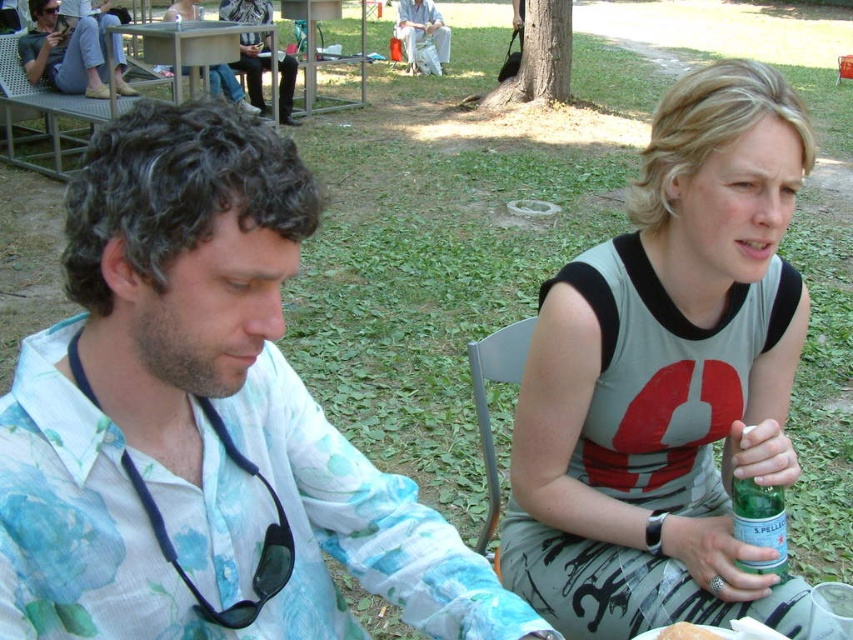
Question: Which object is closer to the camera taking this photo?

Choices:
 (A) black fabric stethoscope at left
 (B) gray fabric tank top at upper right

Answer: (A)

Question: Is gray fabric tank top at upper right thinner than green glass bottle at lower right?

Choices:
 (A) yes
 (B) no

Answer: (B)

Question: Estimate the real-world distances between objects in this image. Which object is closer to the white fluffy bread at lower center?

Choices:
 (A) matte black sunglasses at upper left
 (B) floral cotton shirt at left
 (C) green glass bottle at lower right

Answer: (C)

Question: Is green glass bottle at lower right smaller than white fluffy bread at lower center?

Choices:
 (A) yes
 (B) no

Answer: (B)

Question: Which object appears farthest from the camera in this image?

Choices:
 (A) floral cotton shirt at left
 (B) white fluffy bread at lower center
 (C) matte black sunglasses at upper left
 (D) gray fabric tank top at upper right

Answer: (C)

Question: Is floral cotton shirt at left further to the viewer compared to matte white pants at center?

Choices:
 (A) yes
 (B) no

Answer: (B)